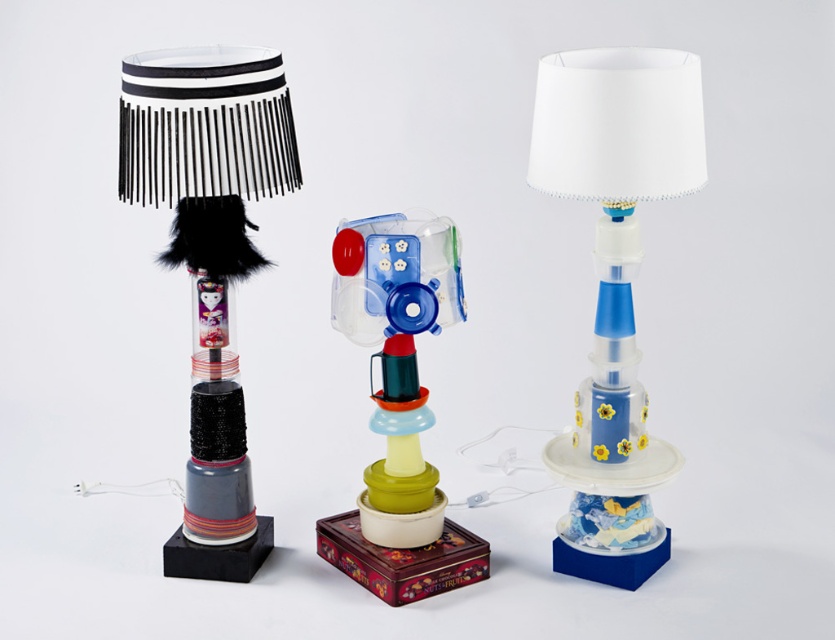
Which object is positioned to the right of the other? The blue glossy lampshade at center or the translucent plastic toy at center?

The blue glossy lampshade at center is positioned to the right of the translucent plastic toy at center.

You are trying to decide which lamp to place on a shelf that can only hold items up to 15 inches tall. The black fabric lampshade at left is 18 inches tall and the translucent plastic toy at center is 12 inches tall. Can both lamps fit on the shelf?

The black fabric lampshade at left is 18 inches tall, which exceeds the shelf height limit of 15 inches. The translucent plastic toy at center is 12 inches tall and can fit. Therefore, only the translucent plastic toy at center will fit on the shelf.

Which lamp has a lampshade located at point (615, 284)?

The blue glossy lampshade at center is located at point (615, 284).